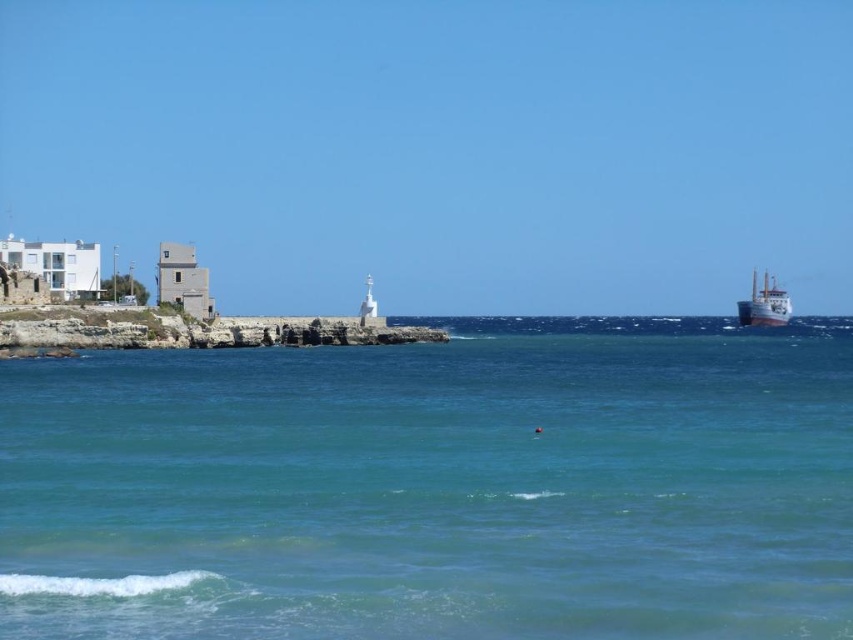
Question: Which point appears farthest from the camera in this image?

Choices:
 (A) (693, 472)
 (B) (747, 312)

Answer: (B)

Question: Does clear blue water at center have a lesser width compared to metallic gray ship at right?

Choices:
 (A) no
 (B) yes

Answer: (A)

Question: Is clear blue water at center closer to camera compared to metallic gray ship at right?

Choices:
 (A) no
 (B) yes

Answer: (B)

Question: Which object appears closest to the camera in this image?

Choices:
 (A) metallic gray ship at right
 (B) clear blue water at center

Answer: (B)

Question: Is clear blue water at center bigger than metallic gray ship at right?

Choices:
 (A) yes
 (B) no

Answer: (A)